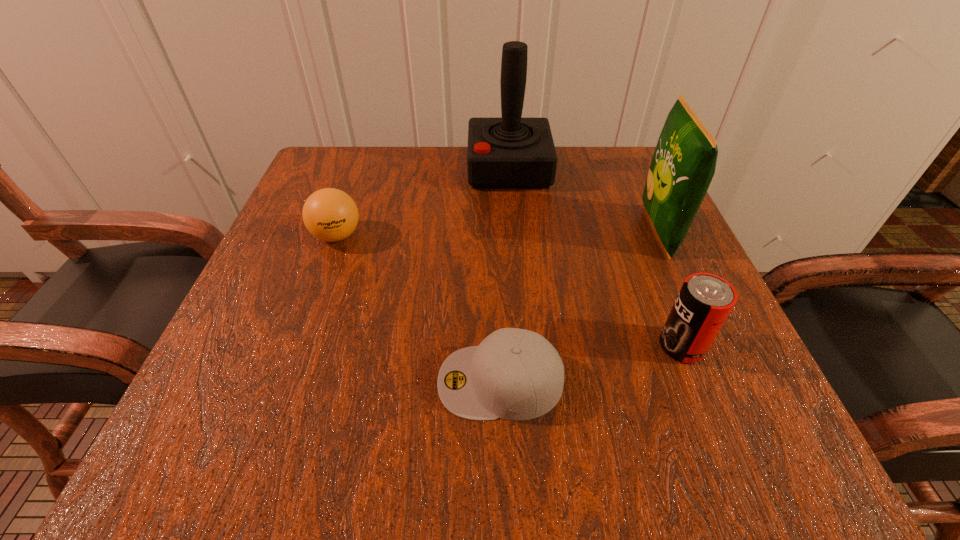
The width and height of the screenshot is (960, 540). I want to click on object situated at the left edge, so click(x=329, y=214).

Locate an element on the screen. Image resolution: width=960 pixels, height=540 pixels. crisp (potato chip) present at the right edge is located at coordinates (683, 165).

The width and height of the screenshot is (960, 540). I want to click on can located at the right edge, so click(704, 302).

Identify the location of object that is positioned at the far right corner. (683, 165).

At what (x,y) coordinates should I click in order to perform the action: click on free region at the far edge. Please return your answer as a coordinate pair (x, y). Looking at the image, I should click on click(x=471, y=198).

Identify the location of free region at the near edge. The image size is (960, 540). (x=639, y=458).

At what (x,y) coordinates should I click in order to perform the action: click on free space at the left edge of the desktop. Please return your answer as a coordinate pair (x, y). This screenshot has width=960, height=540. Looking at the image, I should click on (329, 247).

Where is `vacant space at the right edge`? The image size is (960, 540). vacant space at the right edge is located at coordinates (656, 337).

In order to click on vacant space at the far left corner of the desktop in this screenshot , I will do `click(324, 176)`.

The height and width of the screenshot is (540, 960). Identify the location of free point at the far right corner. (600, 205).